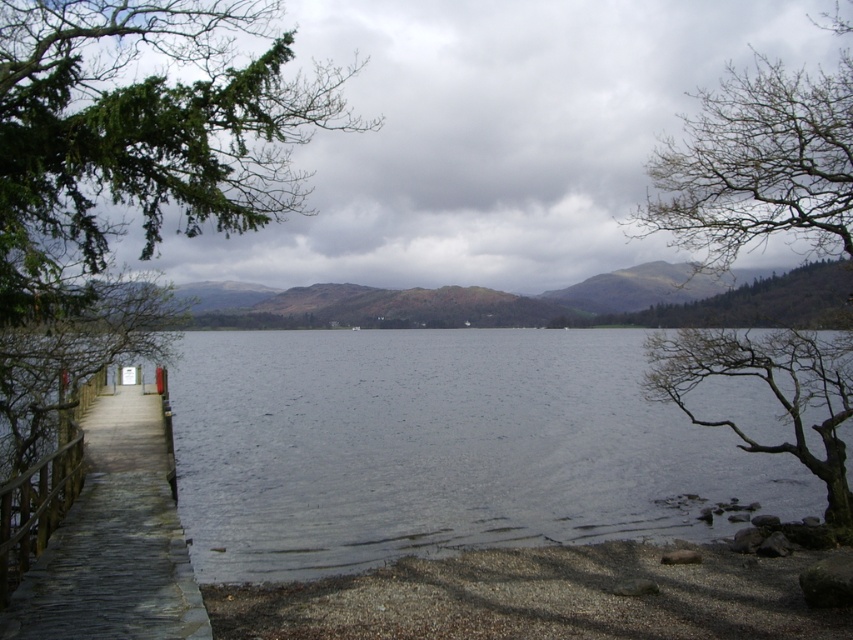
Does gray water at center appear under smooth gravel shore at lower right?

No, gray water at center is not below smooth gravel shore at lower right.

Is gray water at center to the left of smooth gravel shore at lower right from the viewer's perspective?

Yes, gray water at center is to the left of smooth gravel shore at lower right.

Who is more distant from viewer, (178, 410) or (798, 627)?

Positioned behind is point (178, 410).

The image size is (853, 640). Identify the location of gray water at center. (440, 449).

Is bare branches at right shorter than wooden dock at left?

No, bare branches at right is not shorter than wooden dock at left.

Between bare branches at right and wooden dock at left, which one appears on the left side from the viewer's perspective?

From the viewer's perspective, wooden dock at left appears more on the left side.

Is point (672, 396) in front of point (113, 589)?

That is False.

Locate an element on the screen. bare branches at right is located at coordinates (758, 163).

How much distance is there between gray water at center and wooden dock at left?

gray water at center and wooden dock at left are 10.13 meters apart.

Between gray water at center and wooden dock at left, which one has more height?

Standing taller between the two is gray water at center.

Image resolution: width=853 pixels, height=640 pixels. Find the location of `gray water at center`. gray water at center is located at coordinates (440, 449).